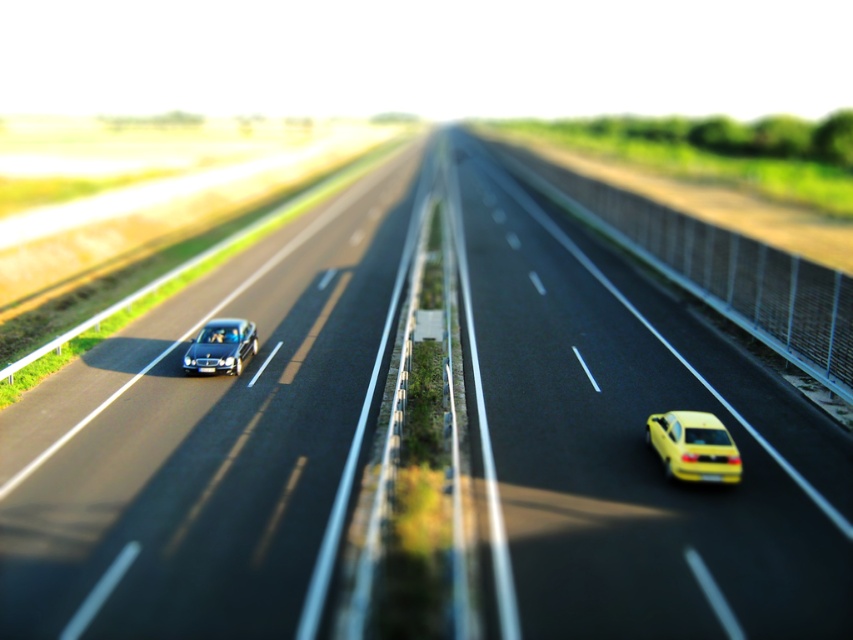
Question: Is shiny metallic car at center to the right of shiny metallic sedan at left from the viewer's perspective?

Choices:
 (A) no
 (B) yes

Answer: (B)

Question: Which point is closer to the camera?

Choices:
 (A) shiny metallic sedan at left
 (B) shiny yellow car at right
 (C) shiny metallic car at center

Answer: (C)

Question: Which point is farther to the camera?

Choices:
 (A) (685, 433)
 (B) (521, 332)

Answer: (B)

Question: Which point appears farthest from the camera in this image?

Choices:
 (A) (213, 320)
 (B) (660, 612)

Answer: (A)

Question: Is the position of shiny metallic car at center less distant than that of shiny yellow car at right?

Choices:
 (A) no
 (B) yes

Answer: (B)

Question: Can you confirm if shiny metallic car at center is positioned below yellow matte car at right?

Choices:
 (A) no
 (B) yes

Answer: (B)